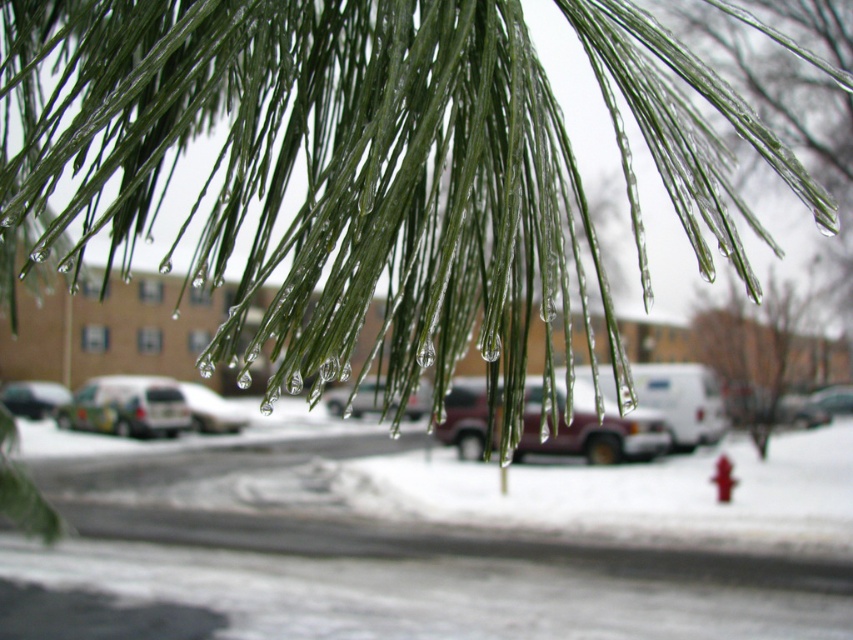
Question: Which of the following is the closest to the observer?

Choices:
 (A) (376, 381)
 (B) (500, 58)
 (C) (64, 387)
 (D) (735, 372)

Answer: (B)

Question: Which point appears farthest from the camera in this image?

Choices:
 (A) (287, 68)
 (B) (711, 481)
 (C) (207, 429)
 (D) (380, 404)

Answer: (B)

Question: Considering the relative positions of green glossy pine needles at upper center and shiny silver suv at center in the image provided, where is green glossy pine needles at upper center located with respect to shiny silver suv at center?

Choices:
 (A) above
 (B) below

Answer: (A)

Question: In this image, where is shiny silver suv at center located relative to red plastic hydrant at lower right?

Choices:
 (A) right
 (B) left

Answer: (B)

Question: Does green matte pine branch at center have a lesser width compared to shiny silver suv at center?

Choices:
 (A) no
 (B) yes

Answer: (A)

Question: Which of these objects is positioned closest to the white matte car at center?

Choices:
 (A) matte white van at center
 (B) green matte pine branch at center
 (C) maroon matte suv at center
 (D) white matte van at lower left

Answer: (D)